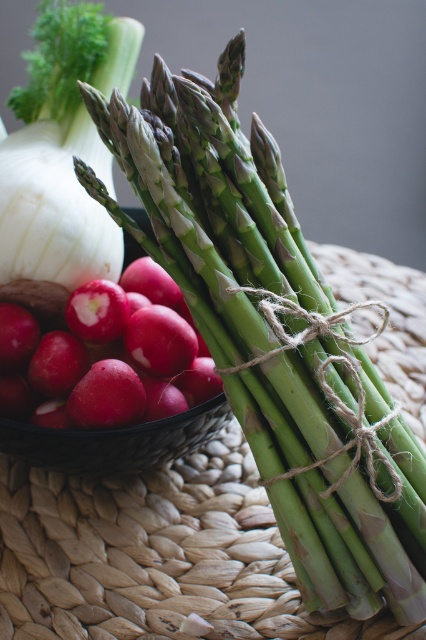
Does smooth red radish at lower left lie behind white smooth onion at upper left?

No.

What do you see at coordinates (106, 355) in the screenshot? The width and height of the screenshot is (426, 640). I see `smooth red radish at lower left` at bounding box center [106, 355].

Who is more distant from viewer, (195, 401) or (26, 262)?

The point (195, 401) is more distant.

Locate an element on the screen. This screenshot has width=426, height=640. smooth red radish at lower left is located at coordinates (106, 355).